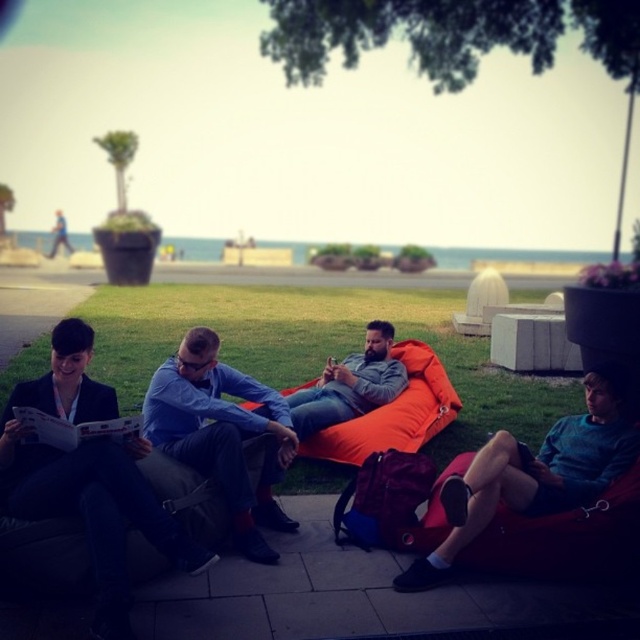
Can you confirm if blue denim jeans at lower left is positioned to the left of orange fabric bean bag at center?

Correct, you'll find blue denim jeans at lower left to the left of orange fabric bean bag at center.

Measure the distance between blue denim jeans at lower left and camera.

blue denim jeans at lower left and camera are 11.39 feet apart from each other.

At what (x,y) coordinates should I click in order to perform the action: click on blue denim jeans at lower left. Please return your answer as a coordinate pair (x, y). The image size is (640, 640). Looking at the image, I should click on (86, 470).

Looking at this image, can you confirm if blue denim jeans at lower left is positioned to the right of matte orange bean bag at center?

No, blue denim jeans at lower left is not to the right of matte orange bean bag at center.

Is point (68, 362) behind point (332, 381)?

No, it is not.

Identify the location of blue denim jeans at lower left. (86, 470).

Does blue denim shirt at center appear on the left side of matte orange bean bag at center?

Correct, you'll find blue denim shirt at center to the left of matte orange bean bag at center.

Can you confirm if blue denim shirt at center is wider than matte orange bean bag at center?

Incorrect, blue denim shirt at center's width does not surpass matte orange bean bag at center's.

Image resolution: width=640 pixels, height=640 pixels. I want to click on blue denim shirt at center, so click(x=221, y=435).